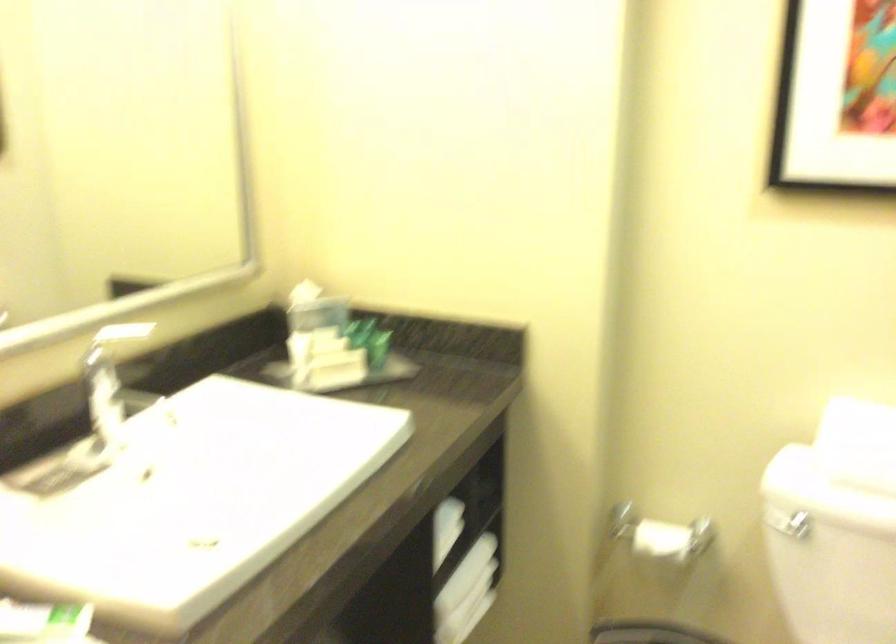
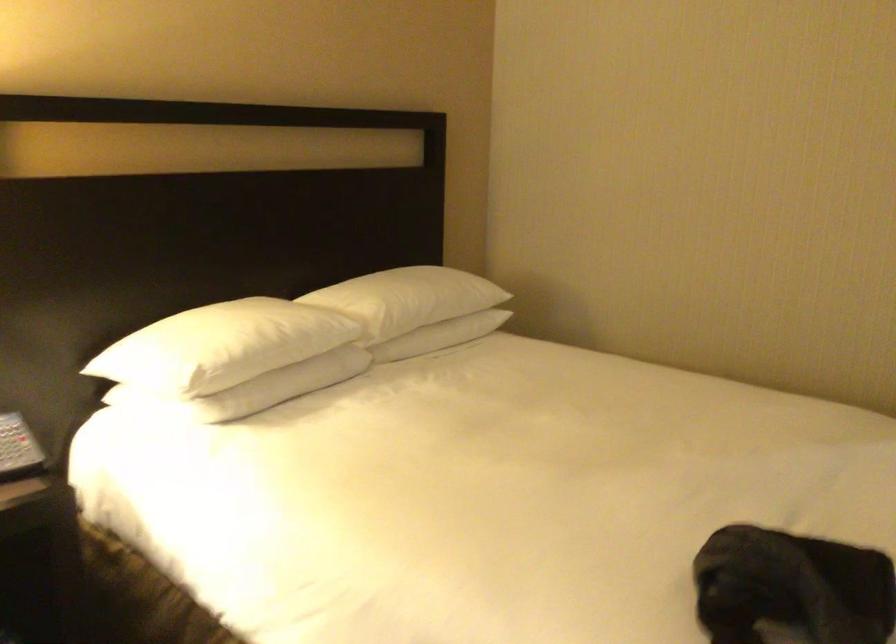
Question: I am providing you with two images of the same scene from different viewpoints. Which of the following objects are not visible in image2?

Choices:
 (A) white bar of soap
 (B) telephone handset
 (C) white pillow
 (D) wooden oar blade

Answer: (A)